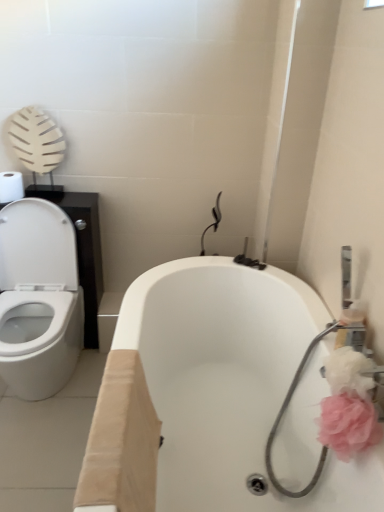
The height and width of the screenshot is (512, 384). In order to click on pink fabric flower at right, which appears as the first flower when ordered from the bottom in this screenshot , I will do `click(348, 425)`.

At what (x,y) coordinates should I click in order to perform the action: click on pink fabric flower at right, which appears as the first flower when ordered from the bottom. Please return your answer as a coordinate pair (x, y). Image resolution: width=384 pixels, height=512 pixels. Looking at the image, I should click on (348, 425).

Does pink fabric flower at right, which appears as the first flower when ordered from the bottom, have a greater width compared to white matte toilet paper at upper left?

In fact, pink fabric flower at right, which appears as the first flower when ordered from the bottom, might be narrower than white matte toilet paper at upper left.

From the picture: Between pink fabric flower at right, which appears as the first flower when ordered from the bottom, and white matte toilet paper at upper left, which one is positioned behind?

white matte toilet paper at upper left is behind.

Is point (324, 408) closer or farther from the camera than point (0, 183)?

Clearly, point (324, 408) is closer to the camera than point (0, 183).

From a real-world perspective, which is physically above, pink fabric flower at right, positioned as the 2th flower in top-to-bottom order, or white matte toilet paper at upper left?

white matte toilet paper at upper left, from a real-world perspective.

Would you say white matte toilet paper at upper left is outside pink fabric flower at right, positioned as the 2th flower in top-to-bottom order?

Absolutely, white matte toilet paper at upper left is external to pink fabric flower at right, positioned as the 2th flower in top-to-bottom order.

Does white matte toilet paper at upper left turn towards pink fabric flower at right, positioned as the 2th flower in top-to-bottom order?

No, white matte toilet paper at upper left does not turn towards pink fabric flower at right, positioned as the 2th flower in top-to-bottom order.

Consider the image. Does white matte toilet paper at upper left come behind pink fabric flower at right, positioned as the 2th flower in top-to-bottom order?

Yes, white matte toilet paper at upper left is further from the viewer.

Is point (363, 385) closer or farther from the camera than point (327, 435)?

Point (363, 385) appears to be farther away from the viewer than point (327, 435).

Which of these two, pink fluffy flower at right, which ranks as the 1th flower in top-to-bottom order, or pink fabric flower at right, which appears as the first flower when ordered from the bottom, is thinner?

pink fabric flower at right, which appears as the first flower when ordered from the bottom, is thinner.

From a real-world perspective, is pink fluffy flower at right, acting as the second flower starting from the bottom, physically below pink fabric flower at right, positioned as the 2th flower in top-to-bottom order?

No, from a real-world perspective, pink fluffy flower at right, acting as the second flower starting from the bottom, is not below pink fabric flower at right, positioned as the 2th flower in top-to-bottom order.

From the image's perspective, which object appears higher, pink fluffy flower at right, which ranks as the 1th flower in top-to-bottom order, or pink fabric flower at right, positioned as the 2th flower in top-to-bottom order?

pink fluffy flower at right, which ranks as the 1th flower in top-to-bottom order, from the image's perspective.

Is point (133, 394) in front of point (365, 384)?

No, (133, 394) is behind (365, 384).

From a real-world perspective, is white glossy bathtub at center beneath pink fluffy flower at right, which ranks as the 1th flower in top-to-bottom order?

Yes, from a real-world perspective, white glossy bathtub at center is below pink fluffy flower at right, which ranks as the 1th flower in top-to-bottom order.

Can you confirm if white glossy bathtub at center is wider than pink fluffy flower at right, acting as the second flower starting from the bottom?

Yes.

Where is `toilet paper on the left side of white glossy bathtub at center`? toilet paper on the left side of white glossy bathtub at center is located at coordinates (11, 186).

Is white glossy bathtub at center completely or partially outside of white matte toilet paper at upper left?

Yes.

Is the depth of white glossy bathtub at center less than that of white matte toilet paper at upper left?

Yes.

Considering the relative positions of white matte toilet paper at upper left and white glossy bathtub at center in the image provided, is white matte toilet paper at upper left to the right of white glossy bathtub at center from the viewer's perspective?

In fact, white matte toilet paper at upper left is to the left of white glossy bathtub at center.

Is white matte toilet paper at upper left facing towards white glossy bathtub at center?

No, white matte toilet paper at upper left is not oriented towards white glossy bathtub at center.

Which object is more forward, white matte toilet paper at upper left or white glossy bathtub at center?

white glossy bathtub at center is in front.

Considering the sizes of objects white matte toilet paper at upper left and white glossy bathtub at center in the image provided, who is taller, white matte toilet paper at upper left or white glossy bathtub at center?

With more height is white glossy bathtub at center.

Is pink fluffy flower at right, which ranks as the 1th flower in top-to-bottom order, touching white matte toilet paper at upper left?

pink fluffy flower at right, which ranks as the 1th flower in top-to-bottom order, is not next to white matte toilet paper at upper left, and they're not touching.

Considering the positions of points (349, 366) and (9, 185), is point (349, 366) farther from camera compared to point (9, 185)?

No.

From a real-world perspective, which is physically below, pink fluffy flower at right, acting as the second flower starting from the bottom, or white matte toilet paper at upper left?

From a 3D spatial view, pink fluffy flower at right, acting as the second flower starting from the bottom, is below.

Considering the relative positions of pink fluffy flower at right, acting as the second flower starting from the bottom, and white matte toilet paper at upper left in the image provided, is pink fluffy flower at right, acting as the second flower starting from the bottom, to the left of white matte toilet paper at upper left from the viewer's perspective?

Incorrect, pink fluffy flower at right, acting as the second flower starting from the bottom, is not on the left side of white matte toilet paper at upper left.

Locate an element on the screen. This screenshot has width=384, height=512. toilet paper located on the left of pink fabric flower at right, which appears as the first flower when ordered from the bottom is located at coordinates (11, 186).

At what (x,y) coordinates should I click in order to perform the action: click on the 2nd flower below the white matte toilet paper at upper left (from the image's perspective). Please return your answer as a coordinate pair (x, y). Looking at the image, I should click on (348, 425).

Which object lies nearer to the anchor point white matte toilet paper at upper left, pink fabric flower at right, which appears as the first flower when ordered from the bottom, or pink fluffy flower at right, acting as the second flower starting from the bottom?

pink fluffy flower at right, acting as the second flower starting from the bottom, is positioned closer to the anchor white matte toilet paper at upper left.

Estimate the real-world distances between objects in this image. Which object is closer to pink fabric flower at right, positioned as the 2th flower in top-to-bottom order, pink fluffy flower at right, which ranks as the 1th flower in top-to-bottom order, or white glossy bathtub at center?

Based on the image, pink fluffy flower at right, which ranks as the 1th flower in top-to-bottom order, appears to be nearer to pink fabric flower at right, positioned as the 2th flower in top-to-bottom order.

Based on their spatial positions, is white matte toilet paper at upper left or white glossy bathtub at center closer to pink fabric flower at right, which appears as the first flower when ordered from the bottom?

white glossy bathtub at center is closer to pink fabric flower at right, which appears as the first flower when ordered from the bottom.

When comparing their distances from white glossy bathtub at center, does pink fabric flower at right, which appears as the first flower when ordered from the bottom, or white matte toilet paper at upper left seem further?

white matte toilet paper at upper left is positioned further to the anchor white glossy bathtub at center.

When comparing their distances from pink fabric flower at right, positioned as the 2th flower in top-to-bottom order, does pink fluffy flower at right, acting as the second flower starting from the bottom, or white matte toilet paper at upper left seem further?

white matte toilet paper at upper left.

Considering their positions, is white glossy bathtub at center positioned further to white matte toilet paper at upper left than pink fluffy flower at right, which ranks as the 1th flower in top-to-bottom order?

The object further to white matte toilet paper at upper left is pink fluffy flower at right, which ranks as the 1th flower in top-to-bottom order.

Considering their positions, is white glossy bathtub at center positioned further to white matte toilet paper at upper left than pink fabric flower at right, positioned as the 2th flower in top-to-bottom order?

Based on the image, pink fabric flower at right, positioned as the 2th flower in top-to-bottom order, appears to be further to white matte toilet paper at upper left.

Which object lies further to the anchor point pink fabric flower at right, which appears as the first flower when ordered from the bottom, white matte toilet paper at upper left or pink fluffy flower at right, acting as the second flower starting from the bottom?

white matte toilet paper at upper left lies further to pink fabric flower at right, which appears as the first flower when ordered from the bottom, than the other object.

Identify the location of flower located between white glossy bathtub at center and pink fluffy flower at right, acting as the second flower starting from the bottom, in the left-right direction. (348, 425).

You are a GUI agent. You are given a task and a screenshot of the screen. Output one action in this format:
    pyautogui.click(x=<x>, y=<y>)
    Task: Click on the flower between white matte toilet paper at upper left and pink fluffy flower at right, which ranks as the 1th flower in top-to-bottom order, from left to right
    This screenshot has height=512, width=384.
    Given the screenshot: What is the action you would take?
    pyautogui.click(x=348, y=425)

Identify the location of bath situated between white matte toilet paper at upper left and pink fluffy flower at right, acting as the second flower starting from the bottom, from left to right. tap(207, 395).

At what (x,y) coordinates should I click in order to perform the action: click on bath located between white matte toilet paper at upper left and pink fabric flower at right, which appears as the first flower when ordered from the bottom, in the left-right direction. Please return your answer as a coordinate pair (x, y). This screenshot has width=384, height=512. Looking at the image, I should click on (207, 395).